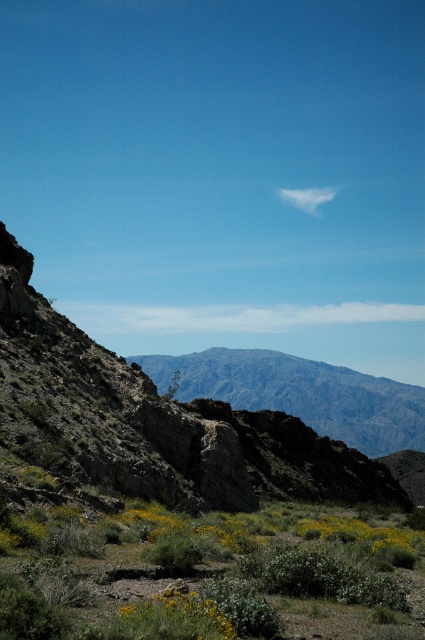
Who is shorter, rocky at center or gray rocky mountain at center?

rocky at center is shorter.

Is rocky at center bigger than gray rocky mountain at center?

No.

Who is more distant from viewer, [272,424] or [308,385]?

The point [308,385] is more distant.

Where is `rocky at center`? This screenshot has height=640, width=425. rocky at center is located at coordinates coord(153,422).